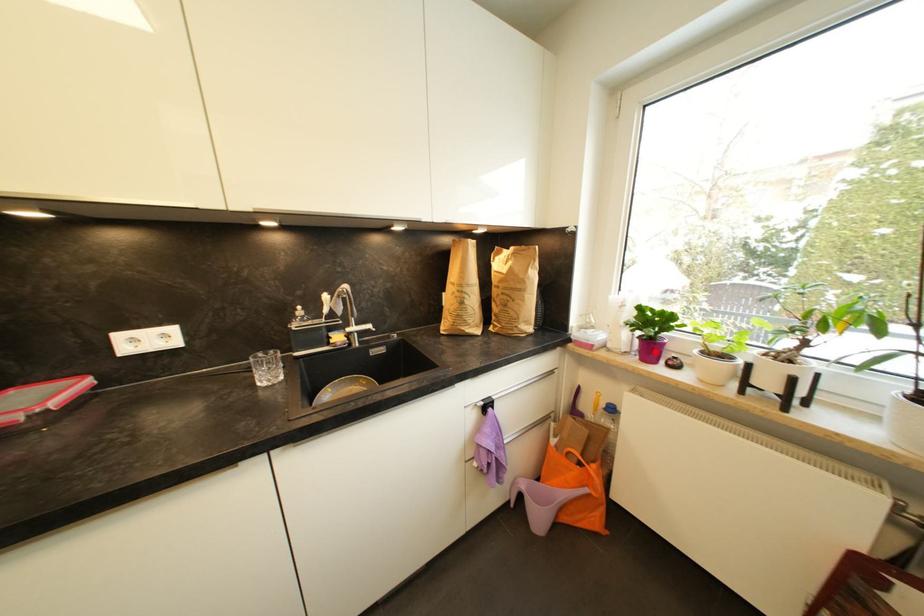
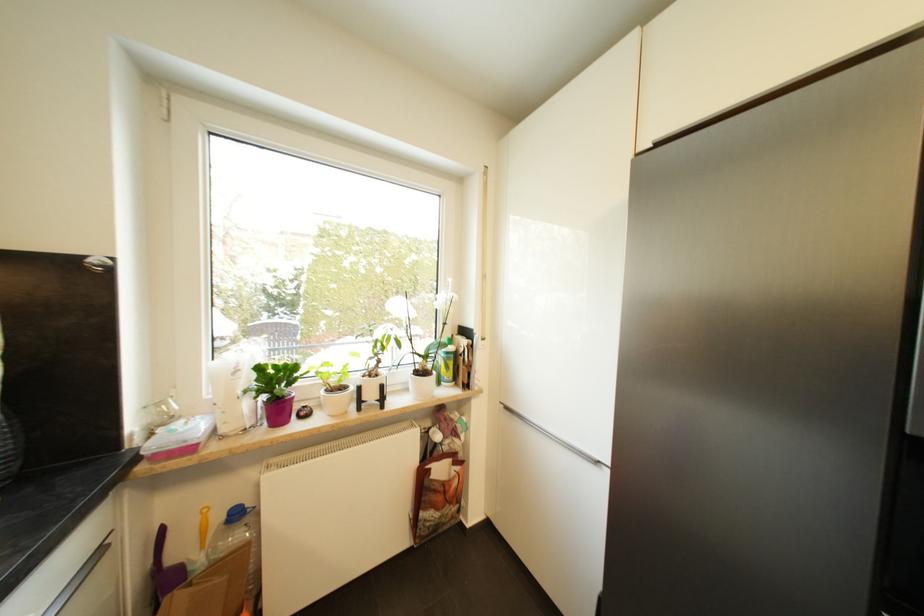
Find the pixel in the second image that matches the highlighted location in the first image.

(285, 411)